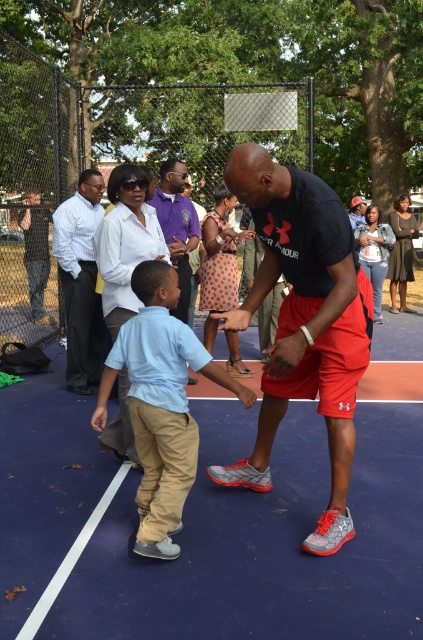
Who is taller, matte black t-shirt at center or light blue cotton shirt at center?

Standing taller between the two is matte black t-shirt at center.

Measure the distance between matte black t-shirt at center and camera.

matte black t-shirt at center and camera are 3.39 meters apart from each other.

This screenshot has width=423, height=640. In order to click on matte black t-shirt at center in this screenshot , I will do `click(302, 321)`.

Locate an element on the screen. Image resolution: width=423 pixels, height=640 pixels. light blue cotton shirt at center is located at coordinates (161, 403).

Is point (156, 346) positioned in front of point (194, 381)?

Yes.

Identify the location of light blue cotton shirt at center. This screenshot has height=640, width=423. (161, 403).

Which is above, white shirt at left or purple cotton polo shirt at upper center?

Positioned higher is purple cotton polo shirt at upper center.

Is white shirt at left taller than purple cotton polo shirt at upper center?

Correct, white shirt at left is much taller as purple cotton polo shirt at upper center.

Who is more forward, (84, 385) or (169, 161)?

Positioned in front is point (169, 161).

You are a GUI agent. You are given a task and a screenshot of the screen. Output one action in this format:
    pyautogui.click(x=<x>, y=<y>)
    Task: Click on the white shirt at left
    This screenshot has width=423, height=640.
    Given the screenshot: What is the action you would take?
    pyautogui.click(x=80, y=282)